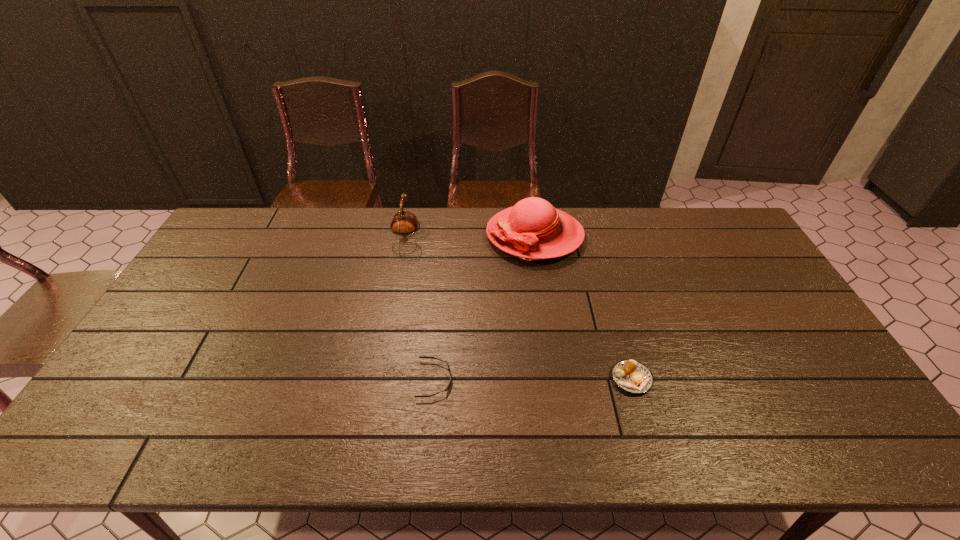
Identify the location of free spot between the tallest object and the third tallest object. (583, 307).

You are a GUI agent. You are given a task and a screenshot of the screen. Output one action in this format:
    pyautogui.click(x=<x>, y=<y>)
    Task: Click on the free space between the second shortest object and the second tallest object
    This screenshot has height=540, width=960.
    Given the screenshot: What is the action you would take?
    pyautogui.click(x=520, y=308)

Where is `vacant space that is in between the telephone and the second object from left to right`? This screenshot has height=540, width=960. vacant space that is in between the telephone and the second object from left to right is located at coordinates (421, 308).

The width and height of the screenshot is (960, 540). What are the coordinates of `free space between the pastry and the tallest object` in the screenshot? It's located at (583, 307).

Image resolution: width=960 pixels, height=540 pixels. I want to click on free space that is in between the telephone and the sunglasses, so click(x=421, y=308).

You are a GUI agent. You are given a task and a screenshot of the screen. Output one action in this format:
    pyautogui.click(x=<x>, y=<y>)
    Task: Click on the unoccupied position between the tallest object and the shortest object
    
    Given the screenshot: What is the action you would take?
    pyautogui.click(x=485, y=307)

Where is `blank region between the tallest object and the second object from left to right`? The width and height of the screenshot is (960, 540). blank region between the tallest object and the second object from left to right is located at coordinates (485, 307).

Locate an element on the screen. free space between the tallest object and the third object from right to left is located at coordinates (485, 307).

At what (x,y) coordinates should I click in order to perform the action: click on object that stands as the closest to the telephone. Please return your answer as a coordinate pair (x, y). Looking at the image, I should click on (533, 229).

Image resolution: width=960 pixels, height=540 pixels. Identify the location of the third closest object to the leftmost object. (633, 377).